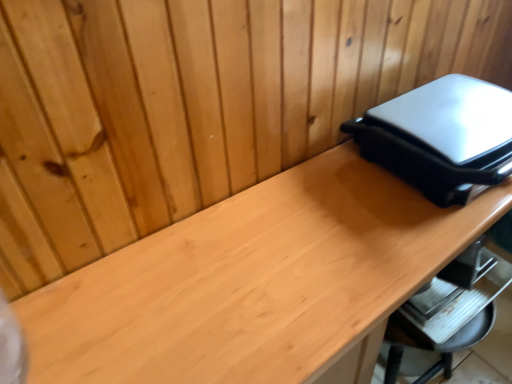
The height and width of the screenshot is (384, 512). I want to click on satin black appliance at upper right, so click(x=441, y=137).

In order to face satin black appliance at upper right, should I rotate leftwards or rightwards?

To face it directly, rotate right by 26.997 degrees.

The width and height of the screenshot is (512, 384). Describe the element at coordinates (441, 137) in the screenshot. I see `satin black appliance at upper right` at that location.

What is the approximate height of satin black appliance at upper right?

It is 5.53 inches.

Find the location of `matte wood desk at right`. matte wood desk at right is located at coordinates (256, 283).

Describe the element at coordinates (256, 283) in the screenshot. I see `matte wood desk at right` at that location.

Image resolution: width=512 pixels, height=384 pixels. Find the location of `satin black appliance at upper right`. satin black appliance at upper right is located at coordinates (441, 137).

Is matte wood desk at right to the right of satin black appliance at upper right from the viewer's perspective?

No.

Is matte wood desk at right behind satin black appliance at upper right?

No, matte wood desk at right is closer to the camera.

Which is closer to the camera, (376, 308) or (370, 150)?

Point (376, 308).

Based on the photo, from the image's perspective, which one is positioned higher, matte wood desk at right or satin black appliance at upper right?

From the image's view, satin black appliance at upper right is above.

From a real-world perspective, is matte wood desk at right physically located above or below satin black appliance at upper right?

Clearly, from a real-world perspective, matte wood desk at right is below satin black appliance at upper right.

Between matte wood desk at right and satin black appliance at upper right, which one has smaller width?

satin black appliance at upper right.

Can you confirm if matte wood desk at right is taller than satin black appliance at upper right?

Yes.

Considering the sizes of objects matte wood desk at right and satin black appliance at upper right in the image provided, who is bigger, matte wood desk at right or satin black appliance at upper right?

With larger size is matte wood desk at right.

Is matte wood desk at right inside the boundaries of satin black appliance at upper right, or outside?

matte wood desk at right exists outside the volume of satin black appliance at upper right.

Is matte wood desk at right positioned far away from satin black appliance at upper right?

matte wood desk at right is actually quite close to satin black appliance at upper right.

Could you tell me if matte wood desk at right is turned towards satin black appliance at upper right?

No.

How many degrees apart are the facing directions of matte wood desk at right and satin black appliance at upper right?

The angular difference between matte wood desk at right and satin black appliance at upper right is 0.71 degrees.

How distant is matte wood desk at right from satin black appliance at upper right?

matte wood desk at right and satin black appliance at upper right are 8.21 inches apart.

Identify the location of appliance that appears above the matte wood desk at right (from a real-world perspective). This screenshot has width=512, height=384. (441, 137).

Between satin black appliance at upper right and matte wood desk at right, which one appears on the left side from the viewer's perspective?

matte wood desk at right.

Relative to matte wood desk at right, is satin black appliance at upper right in front or behind?

Clearly, satin black appliance at upper right is behind matte wood desk at right.

Between point (415, 120) and point (412, 193), which one is positioned behind?

The point (412, 193) is more distant.

From the image's perspective, between satin black appliance at upper right and matte wood desk at right, who is located below?

matte wood desk at right.

From a real-world perspective, which is physically above, satin black appliance at upper right or matte wood desk at right?

In real-world perspective, satin black appliance at upper right is above.

Between satin black appliance at upper right and matte wood desk at right, which one has smaller width?

With smaller width is satin black appliance at upper right.

Which of these two, satin black appliance at upper right or matte wood desk at right, stands taller?

Standing taller between the two is matte wood desk at right.

Looking at this image, which of these two, satin black appliance at upper right or matte wood desk at right, is bigger?

With larger size is matte wood desk at right.

From the picture: Is matte wood desk at right located within satin black appliance at upper right?

No, satin black appliance at upper right does not contain matte wood desk at right.

Is satin black appliance at upper right not near matte wood desk at right?

They are positioned close to each other.

Is satin black appliance at upper right oriented towards matte wood desk at right?

No, satin black appliance at upper right does not turn towards matte wood desk at right.

The width and height of the screenshot is (512, 384). I want to click on appliance behind the matte wood desk at right, so click(441, 137).

The image size is (512, 384). Identify the location of appliance above the matte wood desk at right (from a real-world perspective). (441, 137).

You are a GUI agent. You are given a task and a screenshot of the screen. Output one action in this format:
    pyautogui.click(x=<x>, y=<y>)
    Task: Click on the appliance lying above the matte wood desk at right (from the image's perspective)
    
    Given the screenshot: What is the action you would take?
    pyautogui.click(x=441, y=137)